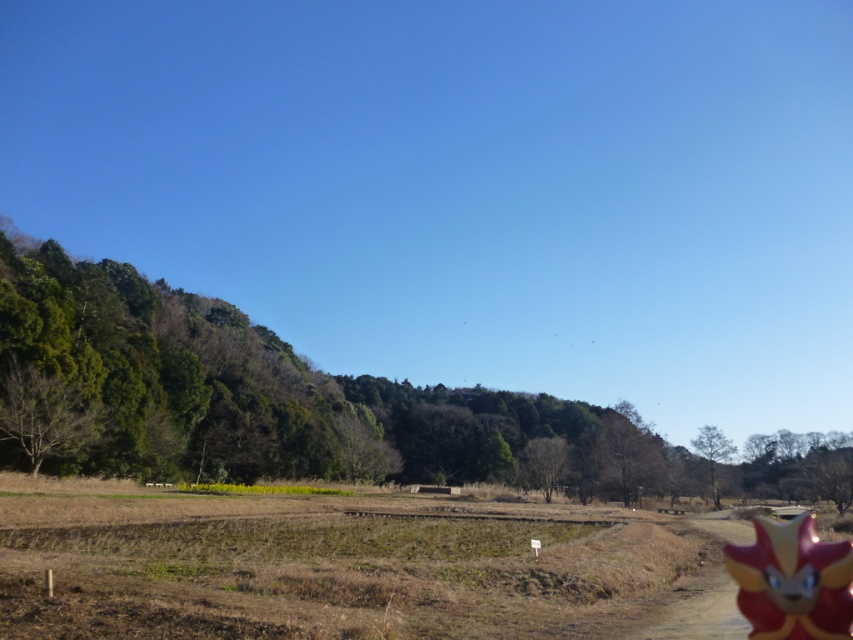
You are a farmer checking your fields and notice the brown soil at center and the shiny plastic toy at lower right. Which object is located below the other?

The brown soil at center is positioned under the shiny plastic toy at lower right.